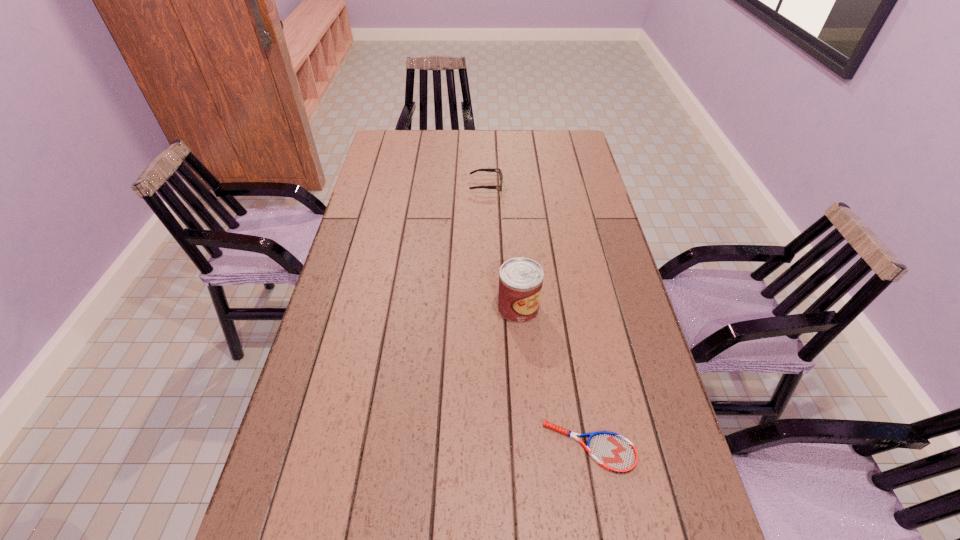
Where is `vacant space located 0.220m on the back of the nearest object`? The width and height of the screenshot is (960, 540). vacant space located 0.220m on the back of the nearest object is located at coordinates (571, 341).

Find the location of a particular element. The height and width of the screenshot is (540, 960). object at the right edge is located at coordinates (612, 451).

Where is `vacant region at the far edge of the desktop`? The width and height of the screenshot is (960, 540). vacant region at the far edge of the desktop is located at coordinates (513, 148).

In the image, there is a desktop. Where is `free space at the left edge`? free space at the left edge is located at coordinates (333, 494).

Locate an element on the screen. Image resolution: width=960 pixels, height=540 pixels. free space at the right edge of the desktop is located at coordinates (636, 327).

I want to click on vacant area between the second tallest object and the nearest object, so click(538, 316).

The width and height of the screenshot is (960, 540). What are the coordinates of `free spot between the second tallest object and the can` in the screenshot? It's located at (502, 247).

Identify the location of vacant area that lies between the tallest object and the tennis racket. (554, 377).

The image size is (960, 540). I want to click on vacant space that is in between the farthest object and the shortest object, so click(538, 316).

The height and width of the screenshot is (540, 960). I want to click on vacant area between the shortest object and the second nearest object, so click(x=554, y=377).